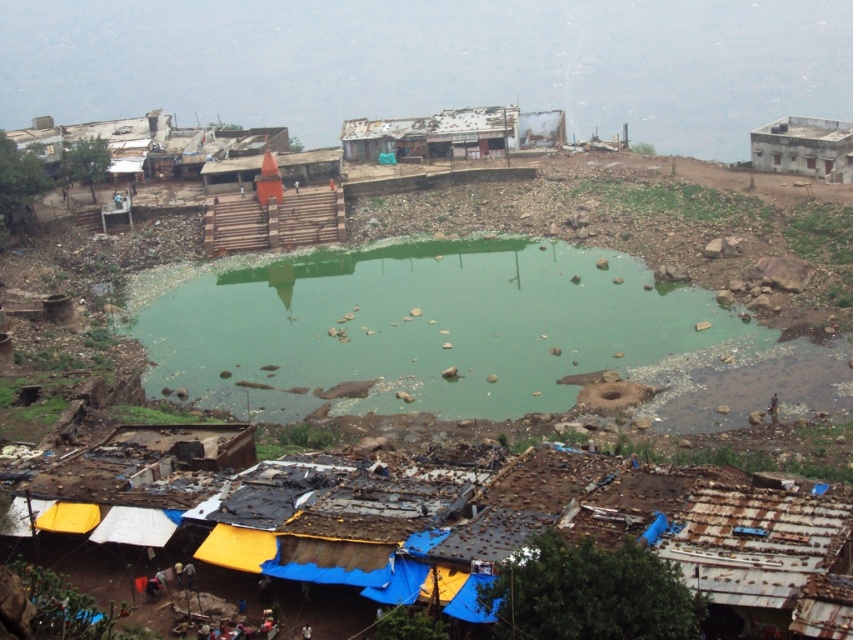
You are standing at the wooden stairs leading up to the platform on the left side of the pond. You need to move towards one of the two points marked in the image. The first point is at coordinates point (505,358) and the second is at point (833,128). Which point is closer to you?

Point (505,358) is closer to the viewer than point (833,128), so you should move towards point (505,358) as it is nearer to your current position at the wooden stairs.

You are standing at the bottom of the wooden stairs leading up to the platform on the left side of the pond. You want to walk to the white concrete building at upper right. Which direction should you go relative to the green murky water at center?

The white concrete building at upper right is located to the right of the green murky water at center. To reach it, you should move towards the right side of the green murky water at center.